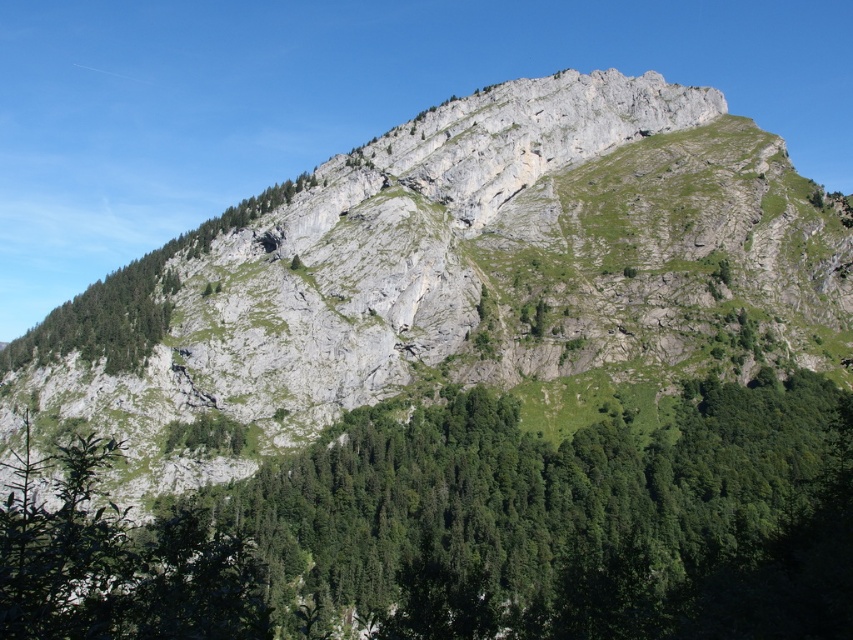
Question: Can you confirm if gray rock mountain at center is wider than green leafy tree at left?

Choices:
 (A) yes
 (B) no

Answer: (A)

Question: Is gray rock mountain at center positioned at the back of green leafy tree at left?

Choices:
 (A) yes
 (B) no

Answer: (B)

Question: Which object is positioned closest to the green leafy tree at left?

Choices:
 (A) gray rock mountain at center
 (B) green leafy trees at center

Answer: (A)

Question: Is gray rock mountain at center bigger than green leafy trees at center?

Choices:
 (A) yes
 (B) no

Answer: (A)

Question: Which of the following is the closest to the observer?

Choices:
 (A) gray rock mountain at center
 (B) green leafy trees at center

Answer: (B)

Question: Among these points, which one is nearest to the camera?

Choices:
 (A) (331, 454)
 (B) (534, 145)

Answer: (A)